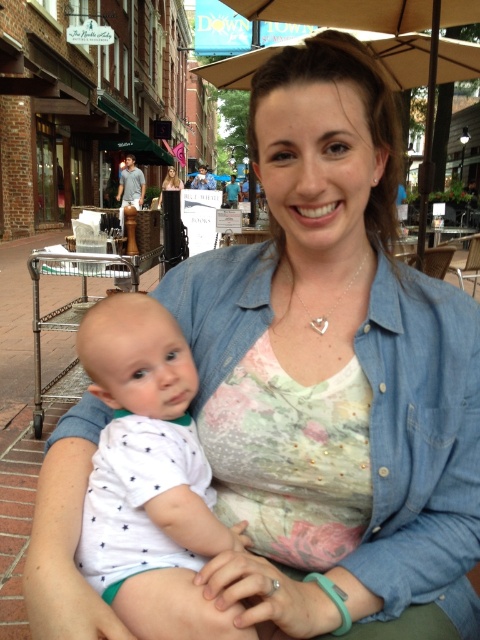
Which is behind, point (425, 564) or point (175, 364)?

The point (175, 364) is behind.

Is denim shirt at center smaller than white soft fabric baby at center?

No, denim shirt at center is not smaller than white soft fabric baby at center.

Who is more distant from viewer, (382, 353) or (131, 416)?

Point (382, 353)

Locate an element on the screen. This screenshot has width=480, height=640. denim shirt at center is located at coordinates (422, 452).

Does white soft fabric baby at center have a smaller size compared to beige fabric umbrella at upper center?

Yes, white soft fabric baby at center is smaller than beige fabric umbrella at upper center.

Which is below, white soft fabric baby at center or beige fabric umbrella at upper center?

white soft fabric baby at center is lower down.

Locate an element on the screen. This screenshot has width=480, height=640. white soft fabric baby at center is located at coordinates (153, 472).

Which is more to the right, denim shirt at center or beige fabric umbrella at upper center?

beige fabric umbrella at upper center

Based on the photo, who is taller, denim shirt at center or beige fabric umbrella at upper center?

Standing taller between the two is beige fabric umbrella at upper center.

At what (x,y) coordinates should I click in order to perform the action: click on denim shirt at center. Please return your answer as a coordinate pair (x, y). Image resolution: width=480 pixels, height=640 pixels. Looking at the image, I should click on (422, 452).